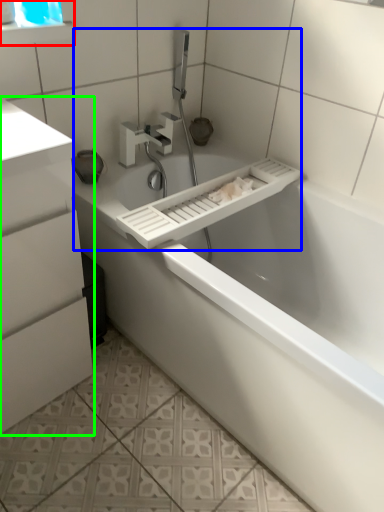
Question: Based on their relative distances, which object is nearer to medicine cabinet (highlighted by a red box)? Choose from sink (highlighted by a blue box) and bathroom cabinet (highlighted by a green box).

Choices:
 (A) sink
 (B) bathroom cabinet

Answer: (A)